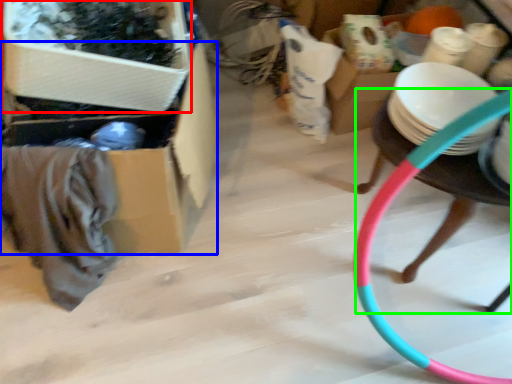
Question: Which is nearer to the storage box (highlighted by a red box)? storage box (highlighted by a blue box) or chair (highlighted by a green box).

Choices:
 (A) storage box
 (B) chair

Answer: (A)